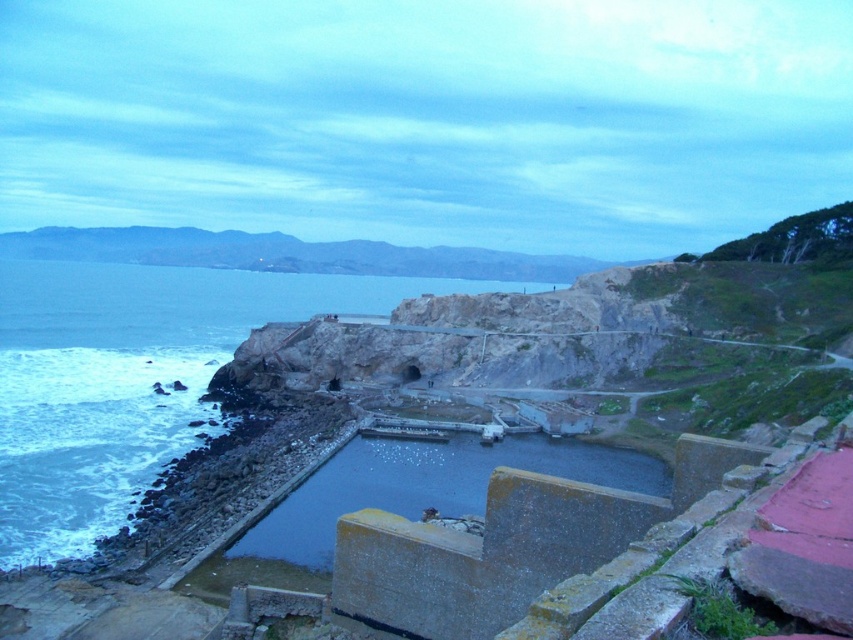
You are standing on the rocky coastline and want to locate the clear blue water at center. According to the coordinates provided, in which direction should you look relative to your position?

The clear blue water at center is located at coordinates point (132, 378), so you should look towards the lower center direction from your current position on the rocky coastline.

You are a sailor trying to navigate through the clear blue water at center and the dark gray concrete water at center. Which one is deeper?

The clear blue water at center is deeper than the dark gray concrete water at center because it is taller.